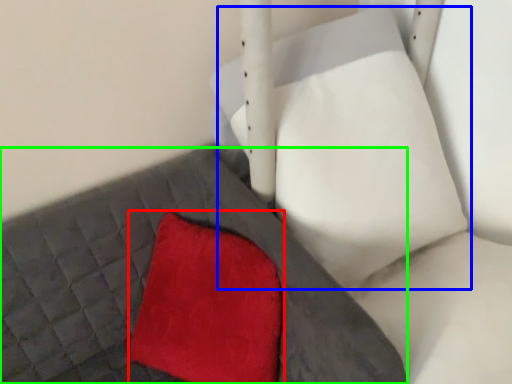
Question: Based on their relative distances, which object is nearer to throw pillow (highlighted by a red box)? Choose from bean bag chair (highlighted by a blue box) and bed frame (highlighted by a green box).

Choices:
 (A) bean bag chair
 (B) bed frame

Answer: (B)